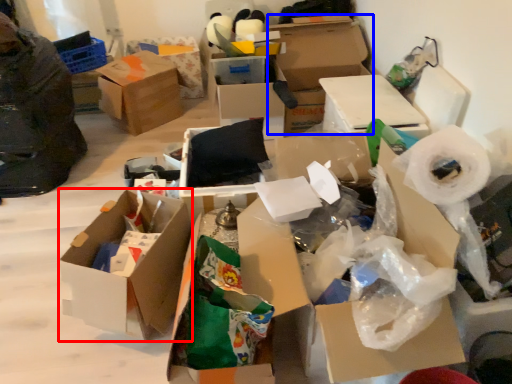
Question: Which object appears farthest to the camera in this image, box (highlighted by a red box) or box (highlighted by a blue box)?

Choices:
 (A) box
 (B) box

Answer: (B)